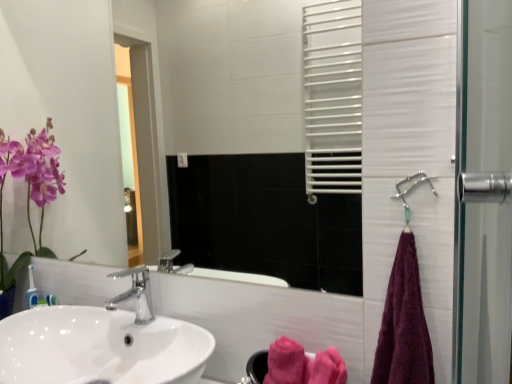
Question: Do you think pink fluffy bath towel at lower center, the 1th bath towel when ordered from back to front, is within polished chrome faucet at center, or outside of it?

Choices:
 (A) outside
 (B) inside

Answer: (A)

Question: From their relative heights in the image, would you say pink fluffy bath towel at lower center, which is the first bath towel in left-to-right order, is taller or shorter than polished chrome faucet at center?

Choices:
 (A) tall
 (B) short

Answer: (B)

Question: Which object is the closest to the white glossy mirror at upper center?

Choices:
 (A) metallic silver shower at right
 (B) white glossy sink at lower left
 (C) polished chrome faucet at center
 (D) purple cotton towel at right, placed as the second bath towel when sorted from back to front
 (E) pink fluffy bath towel at lower center, the 1th bath towel when ordered from back to front

Answer: (B)

Question: Which of these objects is positioned farthest from the purple cotton towel at right, which appears as the first bath towel when viewed from the right?

Choices:
 (A) white glossy mirror at upper center
 (B) metallic silver shower at right
 (C) pink fluffy bath towel at lower center, positioned as the second bath towel in right-to-left order
 (D) white glossy sink at lower left
 (E) polished chrome faucet at center

Answer: (A)